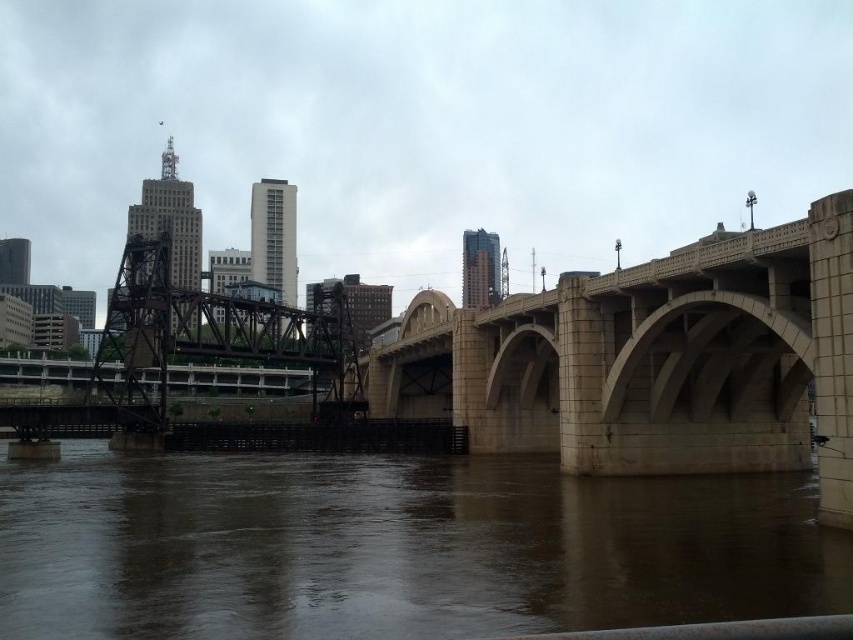
Question: Does matte concrete bridge at center lie in front of brown concrete river at lower center?

Choices:
 (A) yes
 (B) no

Answer: (B)

Question: Which object appears closest to the camera in this image?

Choices:
 (A) brown concrete river at lower center
 (B) matte concrete bridge at center

Answer: (A)

Question: In this image, where is matte concrete bridge at center located relative to brown concrete river at lower center?

Choices:
 (A) left
 (B) right

Answer: (A)

Question: In this image, where is matte concrete bridge at center located relative to brown concrete river at lower center?

Choices:
 (A) above
 (B) below

Answer: (A)

Question: Which point is closer to the camera taking this photo?

Choices:
 (A) (135, 563)
 (B) (427, 6)

Answer: (A)